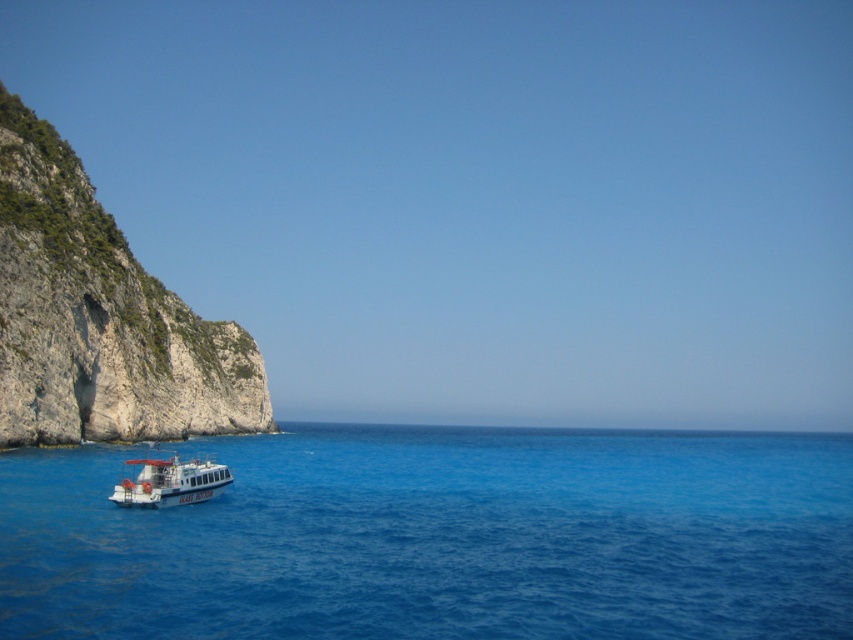
You are standing on the rugged stone cliff at left and want to get to the white glossy boat at lower left. Which direction should you move to reach it?

You should move to the right because the rugged stone cliff at left is to the left of the white glossy boat at lower left, so moving right from the cliff will lead you towards the boat.

You are a photographer planning to take a wide shot of the rugged stone cliff at left and the white glossy boat at lower left. Given that the cliff is larger than the boat, how should you position them in your frame to ensure both are clearly visible?

Since the rugged stone cliff at left is larger in size than the white glossy boat at lower left, position the boat closer to the cliff to balance their sizes in the frame. This way, the boat will appear larger relative to the cliff, ensuring both are clearly visible.